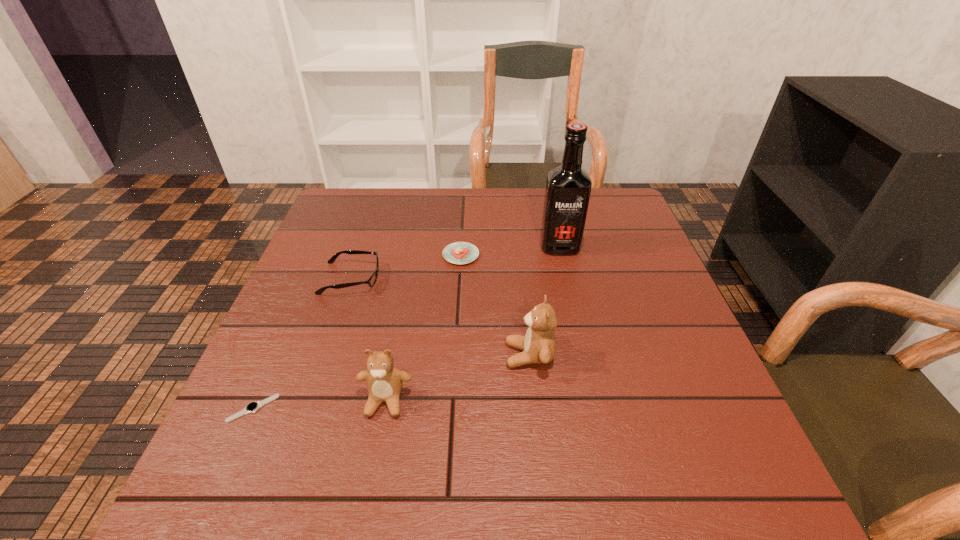
The height and width of the screenshot is (540, 960). Identify the location of free space located on the front-facing side of the left teddy bear. (377, 446).

Find the location of a particular element. The height and width of the screenshot is (540, 960). vacant space located 0.190m on the front-facing side of the farther teddy bear is located at coordinates (414, 355).

I want to click on free region located on the front-facing side of the farther teddy bear, so click(x=356, y=355).

Locate an element on the screen. This screenshot has width=960, height=540. free location located on the front-facing side of the farther teddy bear is located at coordinates (409, 355).

Image resolution: width=960 pixels, height=540 pixels. Find the location of `free spot located 0.370m on the front of the third object from right to left`. free spot located 0.370m on the front of the third object from right to left is located at coordinates (454, 388).

Find the location of a particular element. The width and height of the screenshot is (960, 540). vacant position located on the front-facing side of the third shortest object is located at coordinates (456, 279).

Where is `free space located on the front-facing side of the tallest object`? free space located on the front-facing side of the tallest object is located at coordinates (572, 301).

Locate an element on the screen. The image size is (960, 540). vacant area situated 0.080m on the back of the watch is located at coordinates (274, 361).

At what (x,y) coordinates should I click in order to perform the action: click on teddy bear at the near edge. Please return your answer as a coordinate pair (x, y). Image resolution: width=960 pixels, height=540 pixels. Looking at the image, I should click on (384, 381).

The image size is (960, 540). What are the coordinates of `watch positioned at the near edge` in the screenshot? It's located at (252, 407).